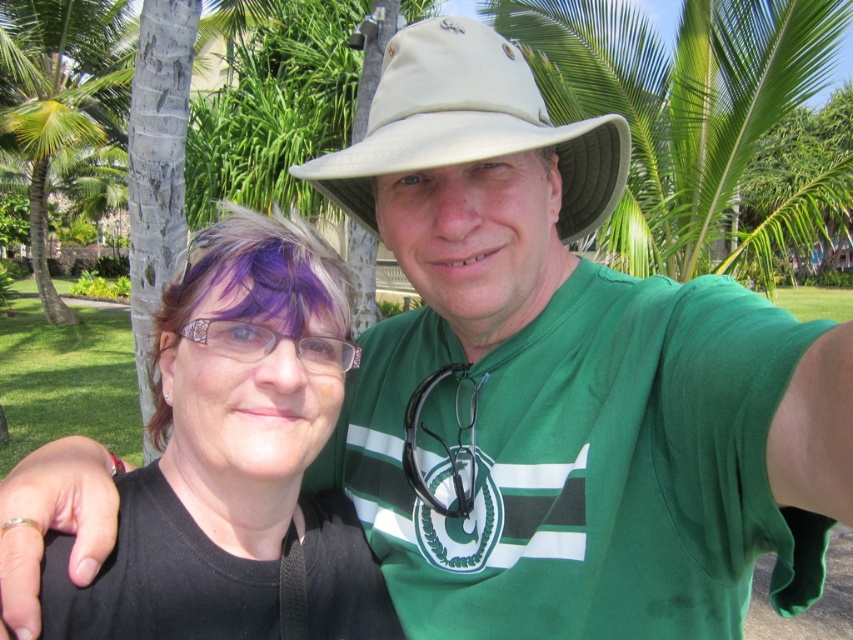
Question: Can you confirm if black matte hair at center is positioned to the right of beige fabric hat at center?

Choices:
 (A) no
 (B) yes

Answer: (A)

Question: Which of the following is the closest to the observer?

Choices:
 (A) green leafy palm tree at upper left
 (B) black matte hair at center
 (C) beige fabric hat at center

Answer: (B)

Question: Which object is farther from the camera taking this photo?

Choices:
 (A) purple dyed hair at left
 (B) beige fabric hat at center
 (C) green leafy palm tree at upper left
 (D) black matte hair at center

Answer: (C)

Question: Can you confirm if beige fabric hat at center is positioned below green leafy palm tree at upper left?

Choices:
 (A) no
 (B) yes

Answer: (B)

Question: Among these objects, which one is nearest to the camera?

Choices:
 (A) purple dyed hair at left
 (B) black matte hair at center

Answer: (B)

Question: Is beige fabric hat at center closer to camera compared to purple dyed hair at left?

Choices:
 (A) no
 (B) yes

Answer: (B)